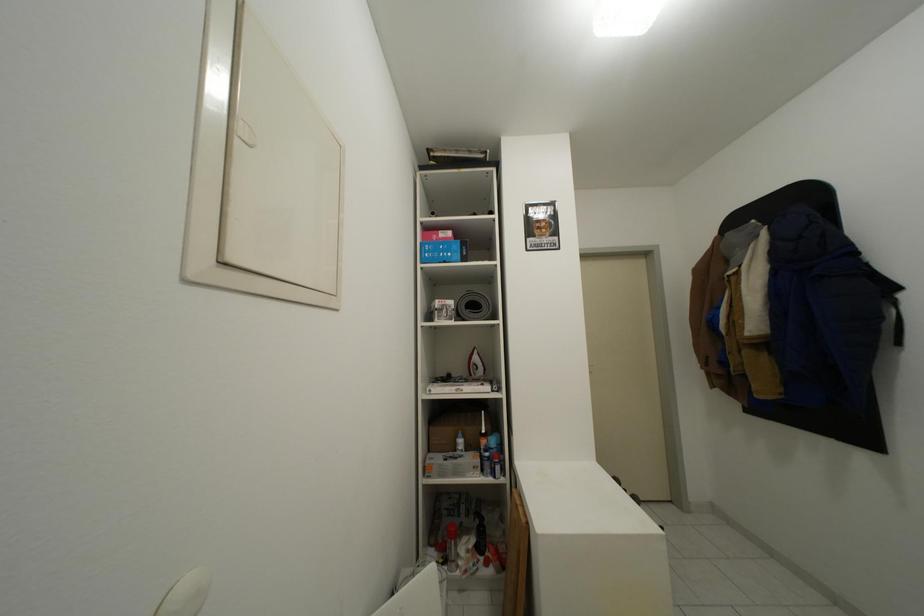
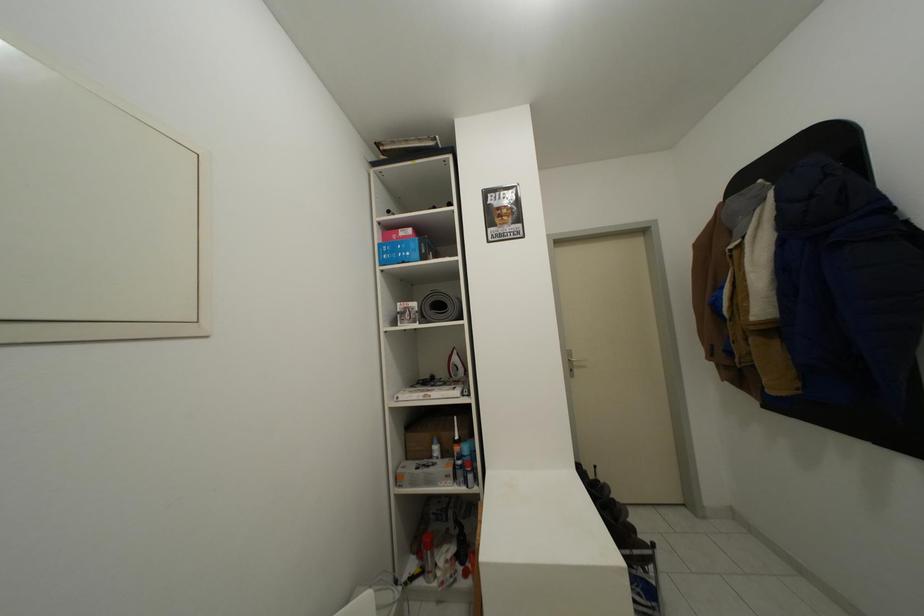
Question: Which direction would the cameraman need to move to produce the second image? Reply with the corresponding letter.

Choices:
 (A) Left
 (B) Right
 (C) Forward
 (D) Backward

Answer: (B)